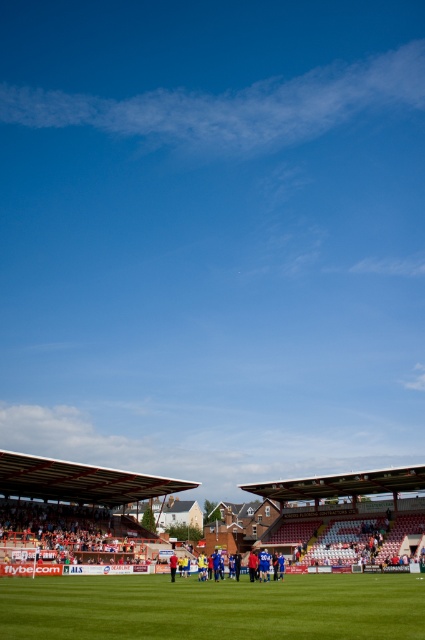
You are a photographer standing at the edge of the green grass football field at center and the blue fabric football team at center. You want to capture a wide shot that includes both the field and the team. Based on their widths, which one should you position closer to the camera to ensure both fit in the frame?

The green grass football field at center is wider than the blue fabric football team at center. To ensure both fit in the frame, position the blue fabric football team at center closer to the camera since wider objects farther away can cause framing issues.

You are a drone operator trying to capture the football field from above. The green grass football field at center is represented by point [212,608]. Where should you position your drone to get a clear aerial view of the green grass football field at center?

To get a clear aerial view of the green grass football field at center, position the drone directly above the point [212,608] where the field is centered.